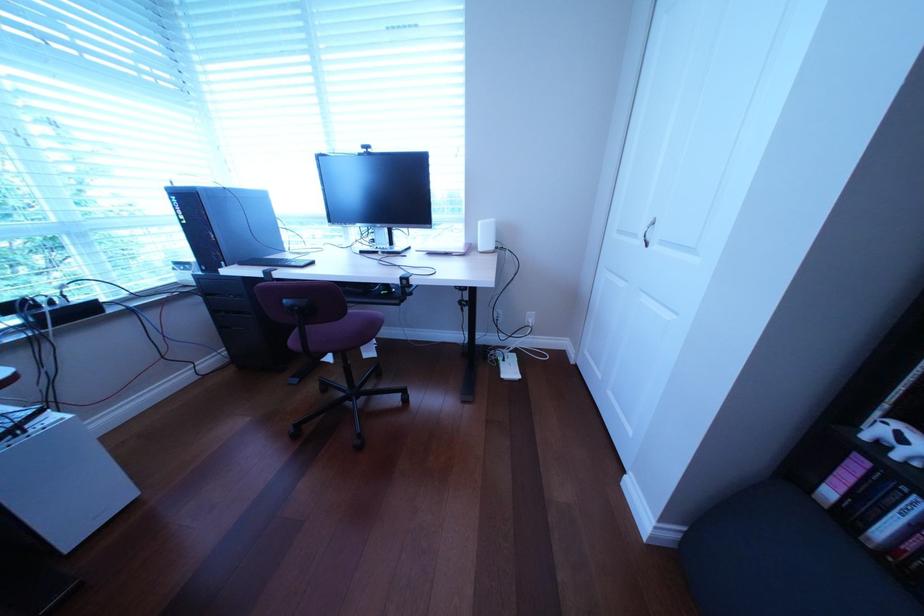
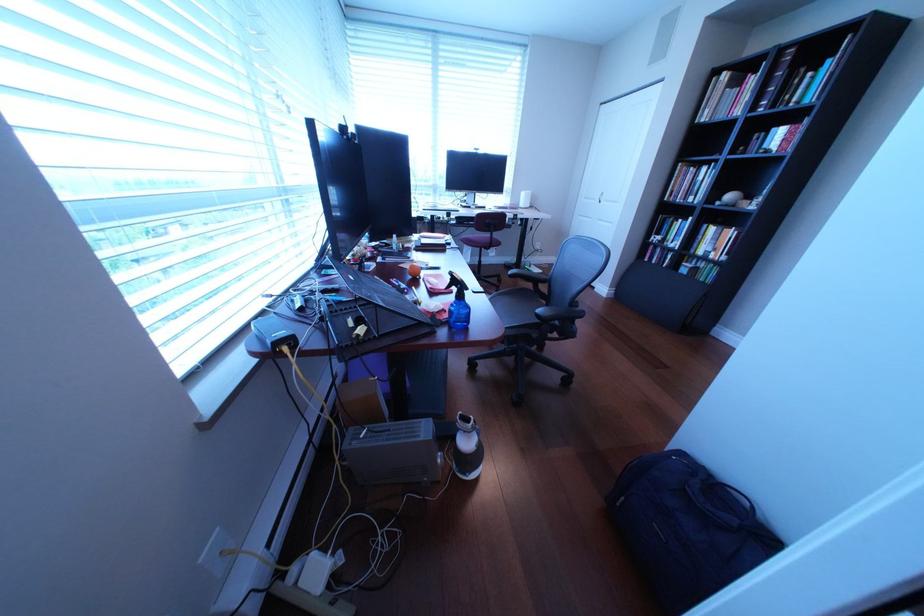
In a continuous first-person perspective shot, in which direction is the camera moving?

The cameraman walked toward left, backward.